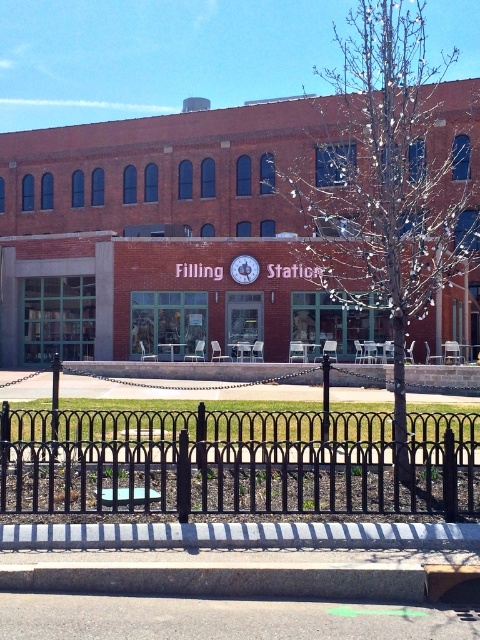
Question: Which point is farther from the camera taking this photo?

Choices:
 (A) (253, 262)
 (B) (218, 499)

Answer: (A)

Question: Can you confirm if black wrought iron fence at lower center is positioned to the left of matte silver clock at center?

Choices:
 (A) no
 (B) yes

Answer: (A)

Question: Which object appears closest to the camera in this image?

Choices:
 (A) black wrought iron fence at lower center
 (B) matte silver clock at center

Answer: (A)

Question: Which point is closer to the camera?

Choices:
 (A) (108, 508)
 (B) (232, 276)

Answer: (A)

Question: Can you confirm if black wrought iron fence at lower center is bigger than matte silver clock at center?

Choices:
 (A) no
 (B) yes

Answer: (A)

Question: Does black wrought iron fence at lower center appear on the right side of matte silver clock at center?

Choices:
 (A) yes
 (B) no

Answer: (A)